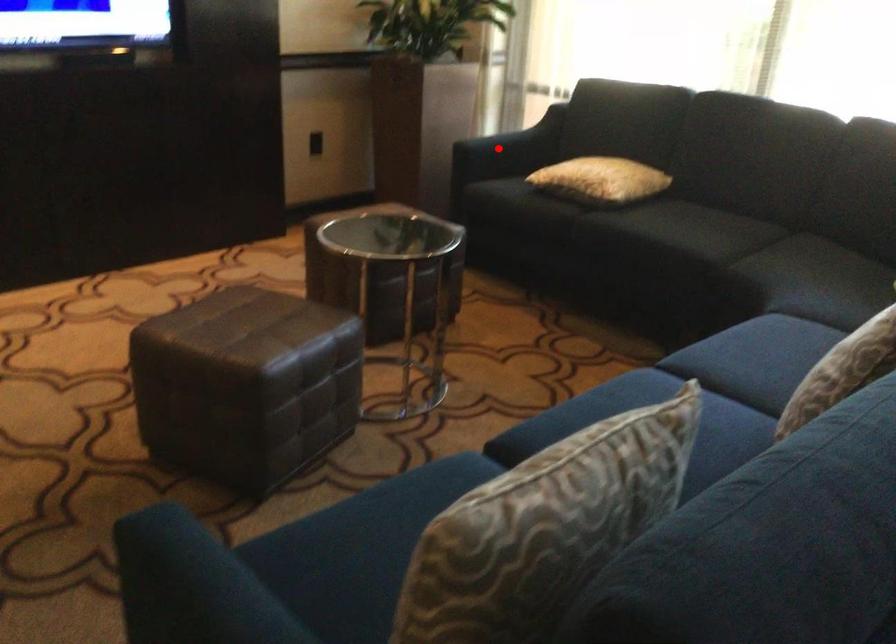
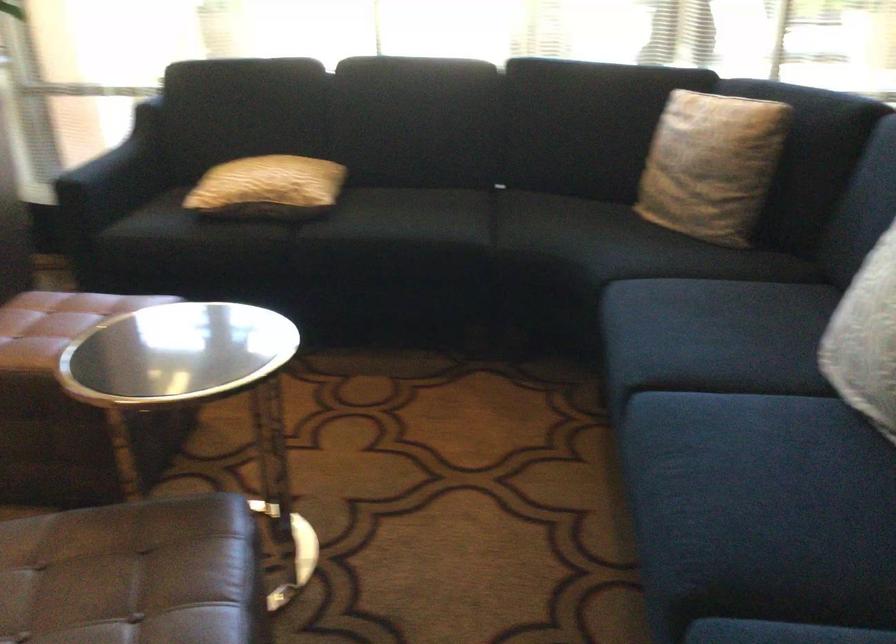
Question: I am providing you with two images of the same scene from different viewpoints. A red point is shown in image1. For the corresponding object point in image2, is it positioned nearer or farther from the camera?

Choices:
 (A) Nearer
 (B) Farther

Answer: (A)